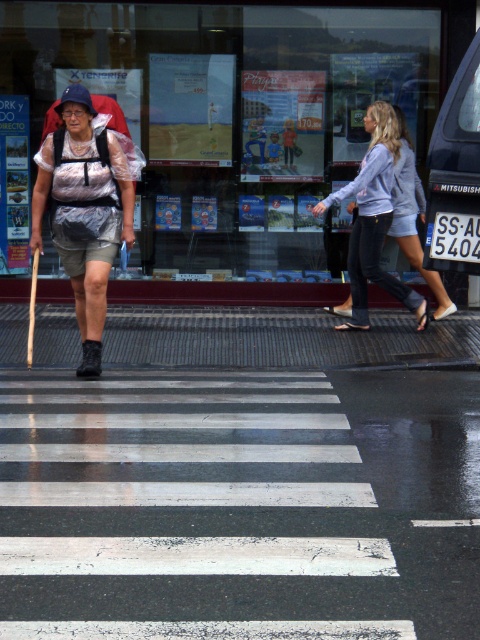
Question: Which object is closer to the camera taking this photo?

Choices:
 (A) matte plastic bag at center
 (B) denim shorts at center

Answer: (A)

Question: Observing the image, what is the correct spatial positioning of matte plastic bag at center in reference to denim shorts at center?

Choices:
 (A) below
 (B) above

Answer: (A)

Question: Is matte plastic bag at center above denim shorts at center?

Choices:
 (A) yes
 (B) no

Answer: (B)

Question: Can you confirm if matte plastic bag at center is bigger than denim shorts at center?

Choices:
 (A) no
 (B) yes

Answer: (A)

Question: Which point appears farthest from the camera in this image?

Choices:
 (A) (91, 179)
 (B) (409, 300)

Answer: (B)